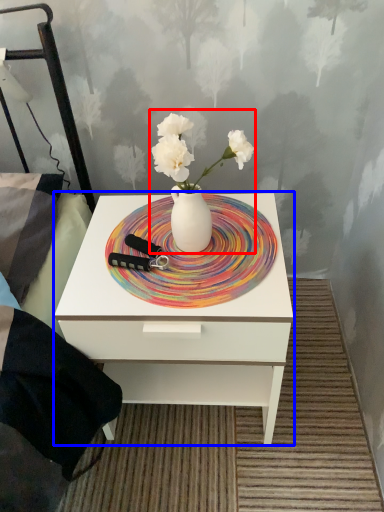
Question: Which object is closer to the camera taking this photo, floral arrangement (highlighted by a red box) or nightstand (highlighted by a blue box)?

Choices:
 (A) floral arrangement
 (B) nightstand

Answer: (A)